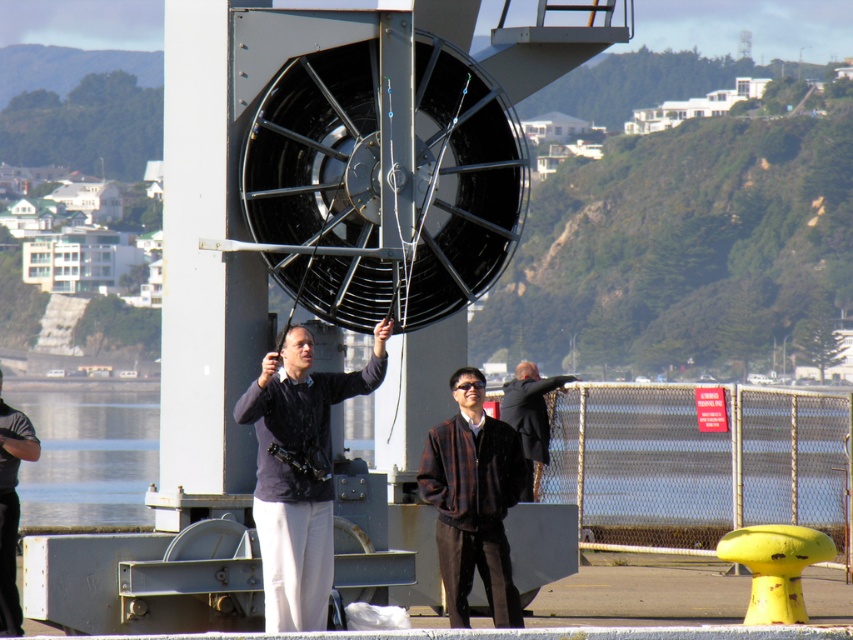
Which of these two, metal mesh fence at lower right or dark brown leather jacket at center, stands shorter?

Standing shorter between the two is dark brown leather jacket at center.

The width and height of the screenshot is (853, 640). I want to click on metal mesh fence at lower right, so click(x=695, y=464).

In order to click on metal mesh fence at lower right in this screenshot , I will do `click(695, 464)`.

Is dark gray fabric jacket at center below dark gray fabric pants at lower left?

No.

Does point (308, 560) come in front of point (16, 435)?

Yes.

Is point (277, 605) less distant than point (7, 612)?

That is True.

Identify the location of dark gray fabric jacket at center. (299, 472).

Can you confirm if plaid fabric jacket at center is bigger than clear water at lower left?

No, plaid fabric jacket at center is not bigger than clear water at lower left.

Which is above, plaid fabric jacket at center or clear water at lower left?

plaid fabric jacket at center is above.

Where is `plaid fabric jacket at center`? plaid fabric jacket at center is located at coordinates (473, 500).